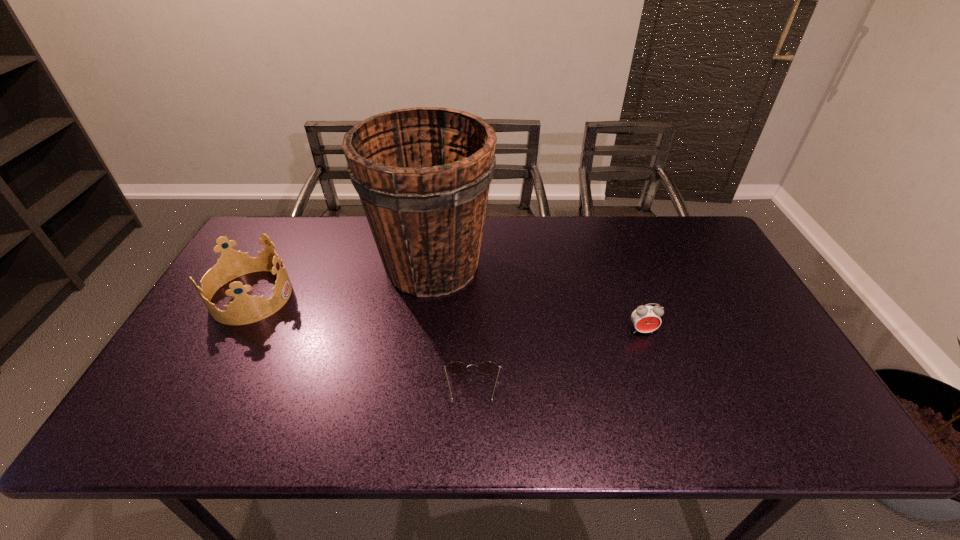
Where is `the tallest object`? Image resolution: width=960 pixels, height=540 pixels. the tallest object is located at coordinates (423, 174).

The width and height of the screenshot is (960, 540). I want to click on the third shortest object, so (245, 309).

Where is `the leftmost object`? This screenshot has height=540, width=960. the leftmost object is located at coordinates (245, 309).

This screenshot has height=540, width=960. In order to click on alarm clock in this screenshot , I will do `click(646, 318)`.

Locate an element on the screen. The image size is (960, 540). the rightmost object is located at coordinates (646, 318).

In order to click on the shortest object in this screenshot , I will do `click(456, 367)`.

Locate an element on the screen. the nearest object is located at coordinates (456, 367).

Identify the location of vacant region located on the left of the tallest object. The height and width of the screenshot is (540, 960). (306, 266).

Identify the location of blank space located 0.380m on the front-facing side of the leftmost object. This screenshot has height=540, width=960. (421, 296).

In order to click on blank area located on the face of the rightmost object in this screenshot , I will do `click(672, 415)`.